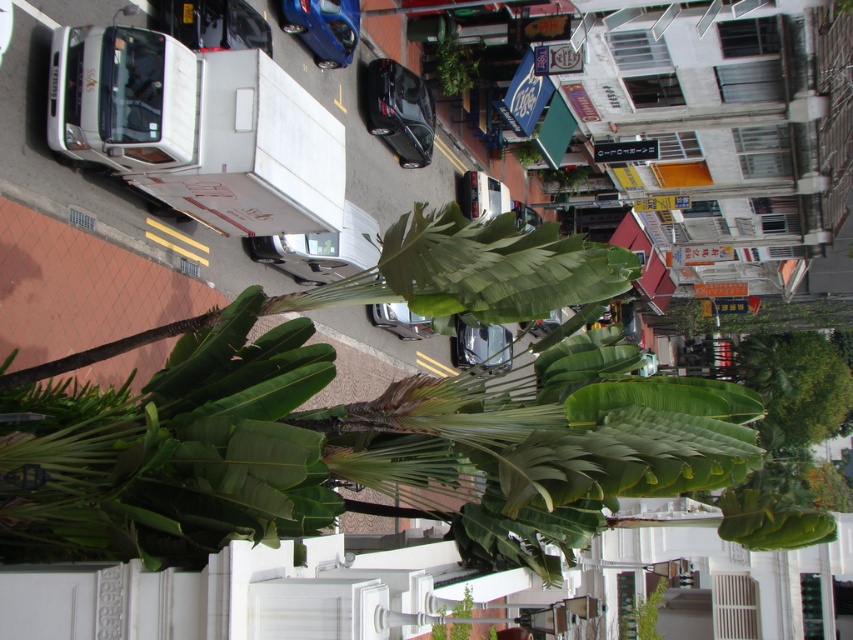
Question: Which of the following is the farthest from the observer?

Choices:
 (A) (653, 628)
 (B) (440, 84)
 (C) (735, 509)
 (D) (344, 22)

Answer: (B)

Question: Is the position of green leafy banana tree at center more distant than that of green leafy plant at center?

Choices:
 (A) yes
 (B) no

Answer: (B)

Question: Is blue metallic car at upper center behind green leafy plant at center?

Choices:
 (A) yes
 (B) no

Answer: (A)

Question: Considering the relative positions of blue metallic car at upper center and green leafy plant at center in the image provided, where is blue metallic car at upper center located with respect to green leafy plant at center?

Choices:
 (A) above
 (B) below

Answer: (A)

Question: Estimate the real-world distances between objects in this image. Which object is closer to the blue metallic car at upper center?

Choices:
 (A) green leafy plant at center
 (B) shiny black car at center
 (C) green leafy plant at upper center
 (D) green leafy banana tree at center

Answer: (B)

Question: Which point is farther to the camera?

Choices:
 (A) coord(700,416)
 (B) coord(639,627)

Answer: (B)